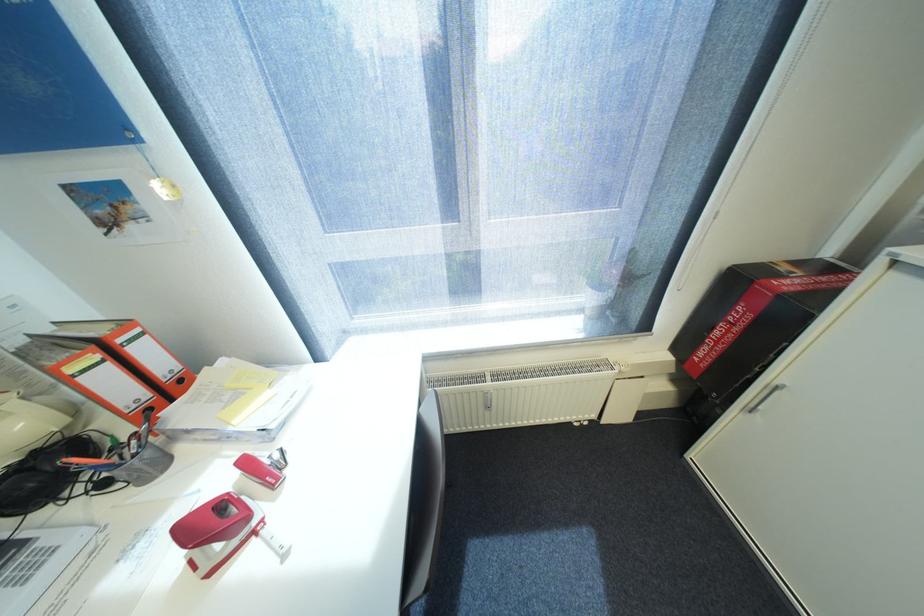
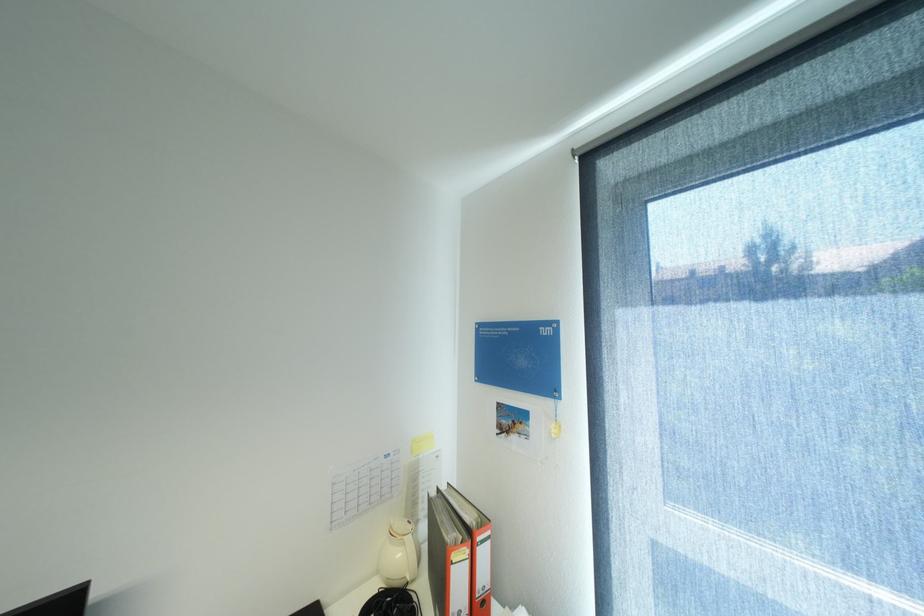
The point at (30, 424) is marked in the first image. Where is the corresponding point in the second image?

(407, 554)